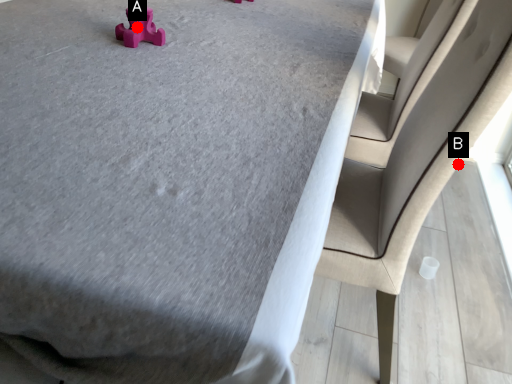
Question: Two points are circled on the image, labeled by A and B beside each circle. Which point is closer to the camera taking this photo?

Choices:
 (A) A is closer
 (B) B is closer

Answer: (B)